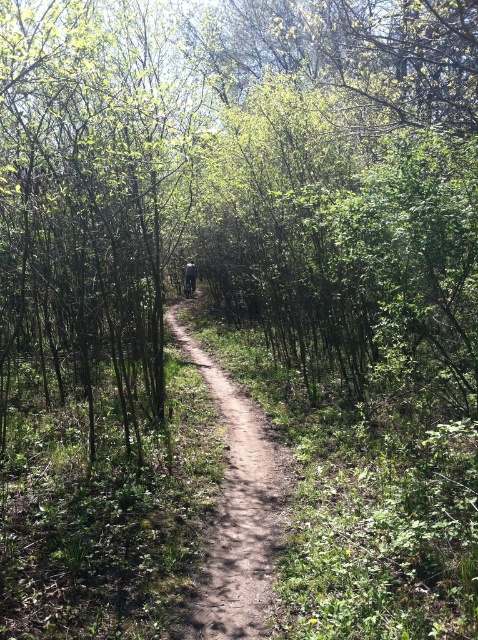
Question: Considering the relative positions of dirt track at center and dark gray fabric backpack at center in the image provided, where is dirt track at center located with respect to dark gray fabric backpack at center?

Choices:
 (A) above
 (B) below

Answer: (B)

Question: Is dirt track at center to the left of dark gray fabric backpack at center from the viewer's perspective?

Choices:
 (A) yes
 (B) no

Answer: (B)

Question: Which point is closer to the camera?

Choices:
 (A) dark gray fabric backpack at center
 (B) dirt track at center

Answer: (B)

Question: Which object appears farthest from the camera in this image?

Choices:
 (A) dark gray fabric backpack at center
 (B) dirt track at center

Answer: (A)

Question: Can you confirm if dirt track at center is wider than dark gray fabric backpack at center?

Choices:
 (A) yes
 (B) no

Answer: (A)